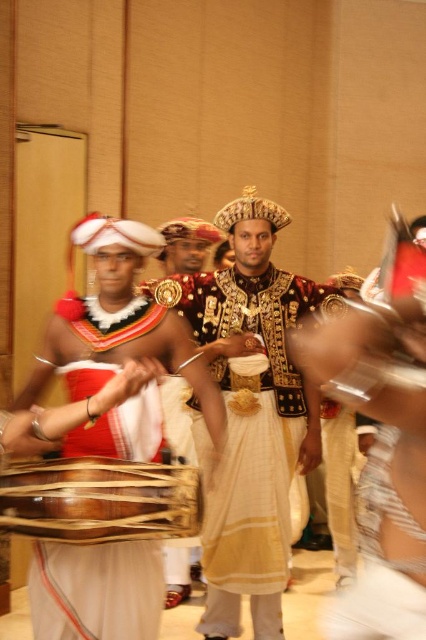
You are an artist trying to sketch the central figure in the scene. To accurately depict the gold textured fabric at center, where should you focus your attention on the image?

The gold textured fabric at center is located at point 0.613 on the horizontal axis and 0.661 on the vertical axis.

You are an audience member sitting in the front row of the stage. You want to toss a flower bouquet to the performer wearing the gold textured fabric at center. The bouquet has a throwing range of 3 meters. Will you be able to reach them?

The gold textured fabric at center is 3.63 meters away from the viewer. Since the bouquet can only reach 3 meters, you won me to toss it that far. Please move closer or find someone with a longer range.

What is the spatial relationship between the gold textured fabric at center and the point labeled as point (261, 422)?

The gold textured fabric at center is represented by point (261, 422).